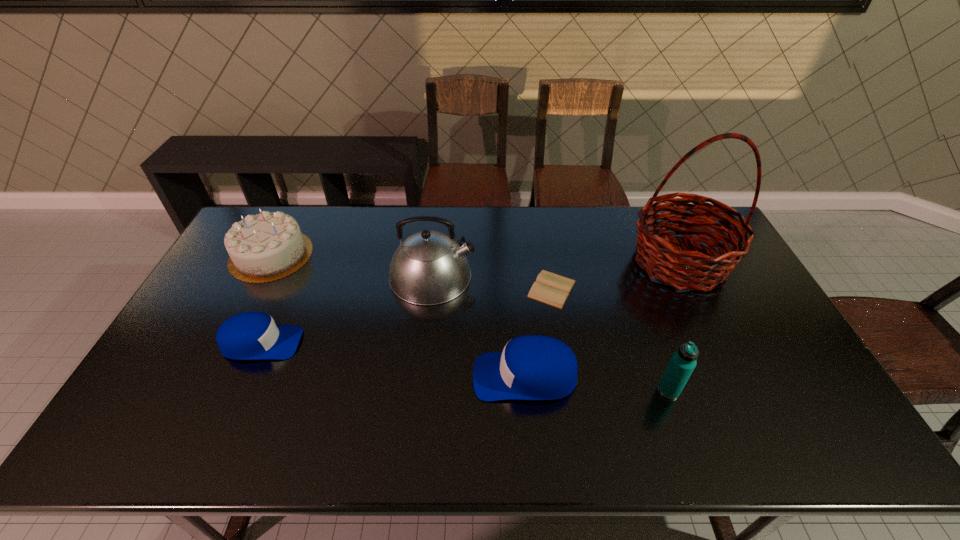
The image size is (960, 540). In order to click on free location at the right edge in this screenshot , I will do `click(780, 351)`.

I want to click on vacant space in between the shorter baseball cap and the basket, so click(470, 302).

This screenshot has width=960, height=540. What are the coordinates of `empty space between the birthday cake and the taller baseball cap` in the screenshot? It's located at pyautogui.click(x=398, y=315).

What are the coordinates of `vacant area that lies between the right baseball cap and the third tallest object` in the screenshot? It's located at (597, 383).

You are a GUI agent. You are given a task and a screenshot of the screen. Output one action in this format:
    pyautogui.click(x=<x>, y=<y>)
    Task: Click on the free space between the third tallest object and the sixth shortest object
    
    Given the screenshot: What is the action you would take?
    pyautogui.click(x=550, y=333)

Where is `unoccupied area between the fifth shortest object and the sixth shortest object`? This screenshot has height=540, width=960. unoccupied area between the fifth shortest object and the sixth shortest object is located at coordinates (550, 333).

Identify the location of vacant area that lies between the basket and the sixth shortest object. (556, 269).

Find the location of `free spot between the basket and the left baseball cap`. free spot between the basket and the left baseball cap is located at coordinates (470, 302).

Identify the location of empty space between the water bottle and the shortest object. Image resolution: width=960 pixels, height=540 pixels. (611, 340).

Locate an element on the screen. The width and height of the screenshot is (960, 540). vacant region between the second tallest object and the shortest object is located at coordinates (492, 282).